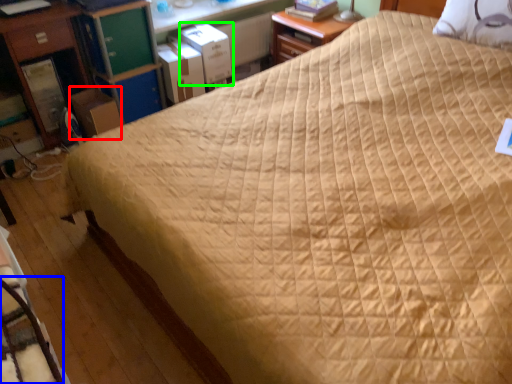
Question: Which object is positioned farthest from cardboard box (highlighted by a red box)? Select from rocking chair (highlighted by a blue box) and cardboard box (highlighted by a green box).

Choices:
 (A) rocking chair
 (B) cardboard box

Answer: (A)